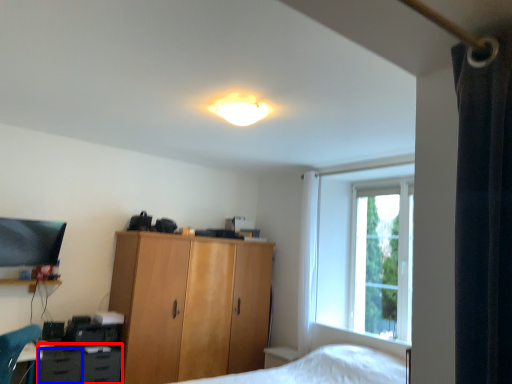
Question: Which point is closer to the camera, cabinetry (highlighted by a red box) or drawer (highlighted by a blue box)?

Choices:
 (A) cabinetry
 (B) drawer

Answer: (B)